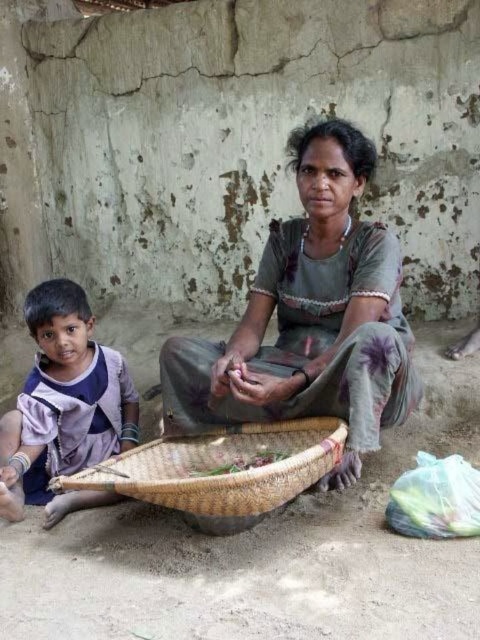
Question: Does gray fabric dress at center have a greater width compared to woven brown basket at lower center?

Choices:
 (A) yes
 (B) no

Answer: (B)

Question: Can you confirm if gray fabric dress at center is positioned to the left of green leafy vegetables at center?

Choices:
 (A) yes
 (B) no

Answer: (B)

Question: Which object appears farthest from the camera in this image?

Choices:
 (A) woven brown basket at lower center
 (B) gray fabric dress at center
 (C) light purple fabric at lower left

Answer: (C)

Question: Which object is positioned closest to the light purple fabric at lower left?

Choices:
 (A) gray fabric dress at center
 (B) green leafy vegetables at center

Answer: (B)

Question: Does gray fabric dress at center appear under light purple fabric at lower left?

Choices:
 (A) no
 (B) yes

Answer: (A)

Question: Which point appears farthest from the camera in this image?

Choices:
 (A) (111, 438)
 (B) (256, 465)
 (C) (346, 340)

Answer: (A)